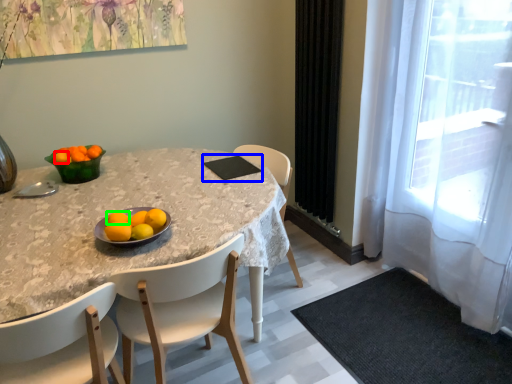
Question: Which is farther away from tangerine (highlighted by a red box)? pad (highlighted by a blue box) or orange (highlighted by a green box)?

Choices:
 (A) pad
 (B) orange

Answer: (A)